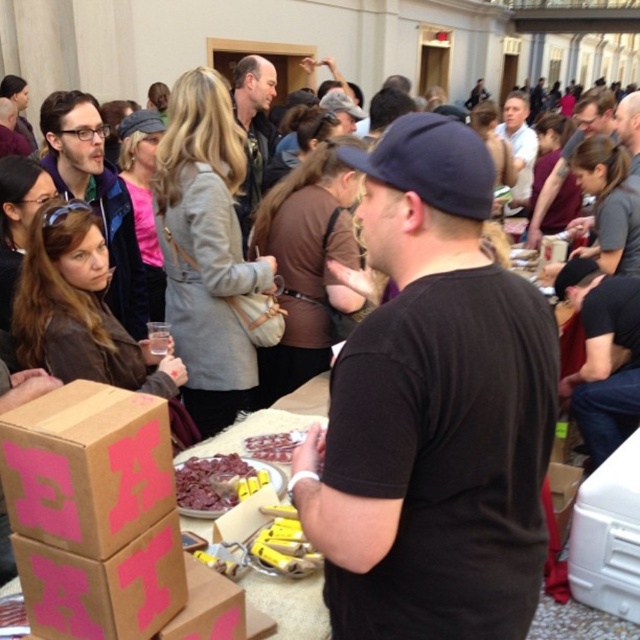
You are attending this event and want to place the shiny chocolate bar at center on top of the brown cardboard box at lower left. Is this possible?

The brown cardboard box at lower left is much taller than the shiny chocolate bar at center, so placing the chocolate bar on top of the box would be possible as the box provides a stable base.

You are at the event and want to approach the person wearing the matte black jacket at left. Which direction should you move relative to the matte black jacket at upper left?

To reach the matte black jacket at left, you should move downward from the matte black jacket at upper left since the matte black jacket at left is positioned under it.